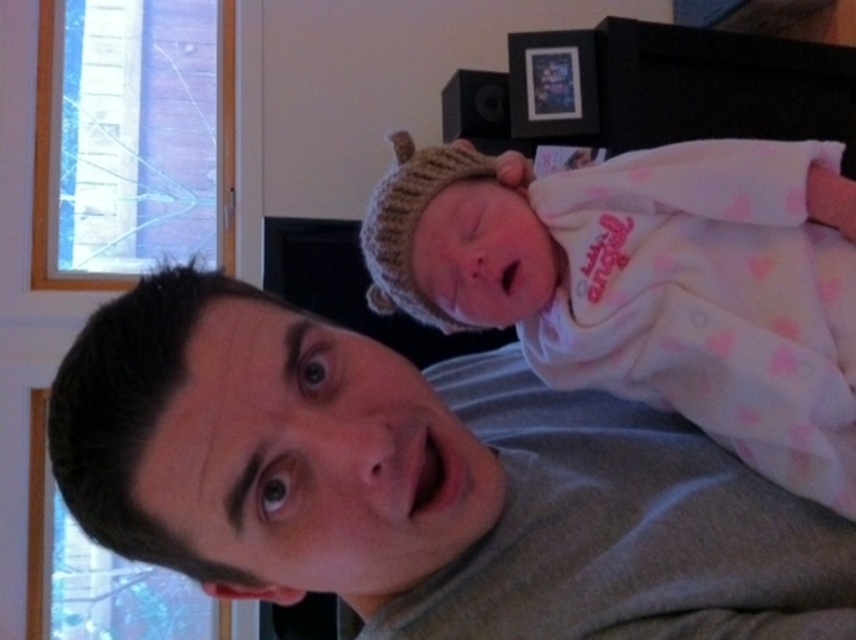
You are a photographer trying to capture a close shot of the baby in the image. The camera you are using has a focal length of 50mm and an aperture of f2.8. You want to ensure that the baby is in focus while the background is blurred. Given that the point at coordinates point (188, 337) is 19.66 inches from the camera, can you determine if the baby is within the depth of field to be in focus?

The point at coordinates point (188, 337) is 19.66 inches from the camera. Since this point is likely where the camera is focused, the baby is within the depth of field and should be in focus, while the background will be blurred as desired.

Consider the image. You are standing in the room and see two points marked in the image. Which point is closer to you, point (331, 444) or point (795, 477)?

Point (331, 444) is in front of point (795, 477), so it is closer to you.